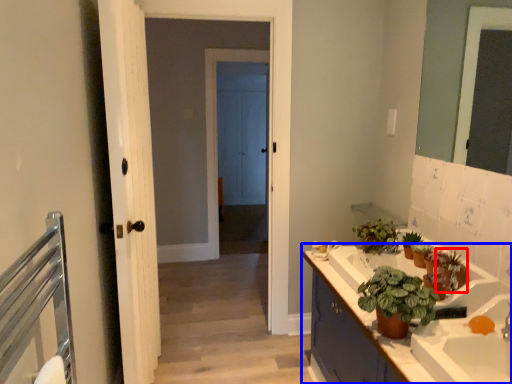
Question: Which of the following is the closest to the observer, plant (highlighted by a red box) or bathroom cabinet (highlighted by a blue box)?

Choices:
 (A) plant
 (B) bathroom cabinet

Answer: (B)